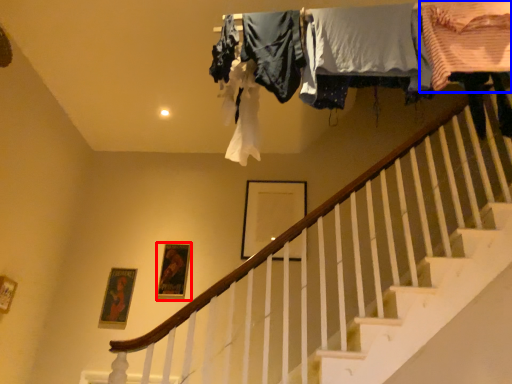
Question: Which of the following is the closest to the observer, picture frame (highlighted by a red box) or clothing (highlighted by a blue box)?

Choices:
 (A) picture frame
 (B) clothing

Answer: (B)